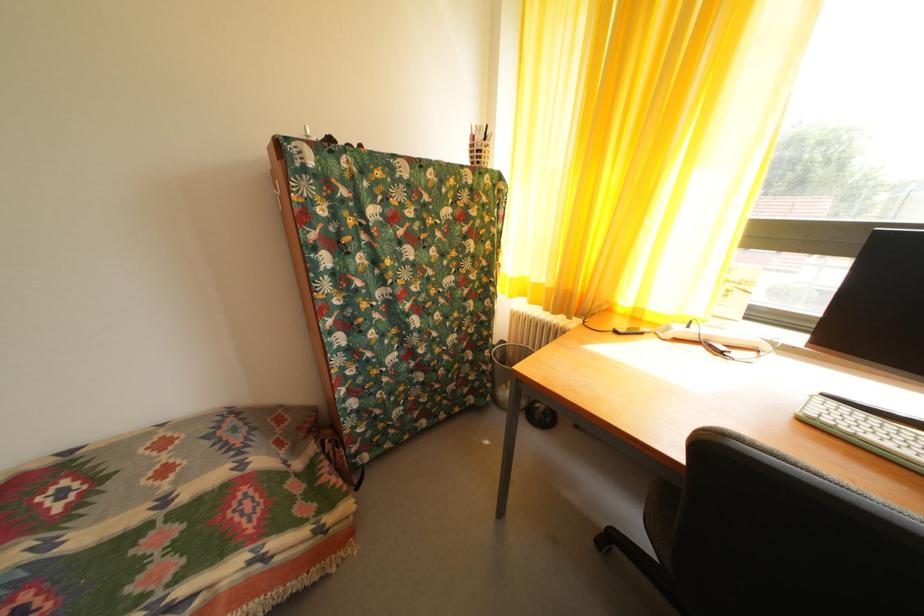
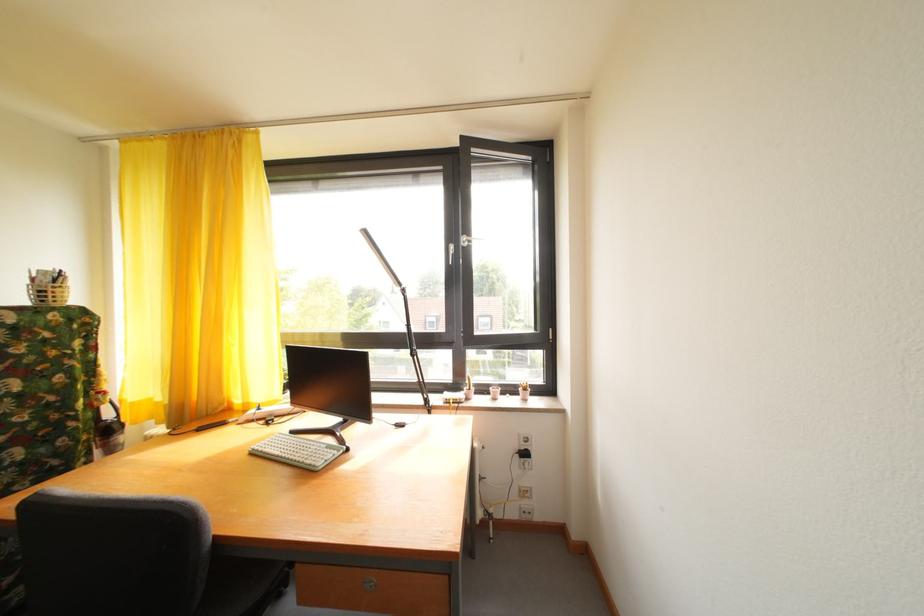
The point at (481, 145) is marked in the first image. Where is the corresponding point in the second image?

(43, 286)